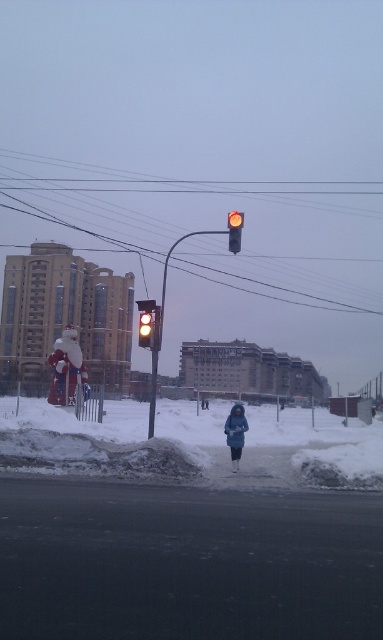
Does point (327, 476) come behind point (67, 324)?

No, it is not.

You are a GUI agent. You are given a task and a screenshot of the screen. Output one action in this format:
    pyautogui.click(x=<x>, y=<y>)
    Task: Click on the white powdery snow at lower center
    This screenshot has width=383, height=640.
    Given the screenshot: What is the action you would take?
    pyautogui.click(x=196, y=445)

You are a GUI agent. You are given a task and a screenshot of the screen. Output one action in this format:
    pyautogui.click(x=<x>, y=<y>)
    Task: Click on the white powdery snow at lower center
    The height and width of the screenshot is (640, 383).
    Given the screenshot: What is the action you would take?
    pyautogui.click(x=196, y=445)

Does dark blue woolen coat at center have a smaller size compared to yellow glass traffic light at left?

Yes.

Can you confirm if dark blue woolen coat at center is positioned below yellow glass traffic light at left?

Yes.

This screenshot has height=640, width=383. Describe the element at coordinates (235, 433) in the screenshot. I see `dark blue woolen coat at center` at that location.

I want to click on dark blue woolen coat at center, so click(x=235, y=433).

Is the position of yellow glass traffic light at left less distant than that of yellow matte traffic light at upper center?

That is True.

Who is shorter, yellow glass traffic light at left or yellow matte traffic light at upper center?

Standing shorter between the two is yellow glass traffic light at left.

Does point (150, 320) lie behind point (238, 228)?

That is True.

Locate an element on the screen. This screenshot has height=640, width=383. yellow glass traffic light at left is located at coordinates (147, 323).